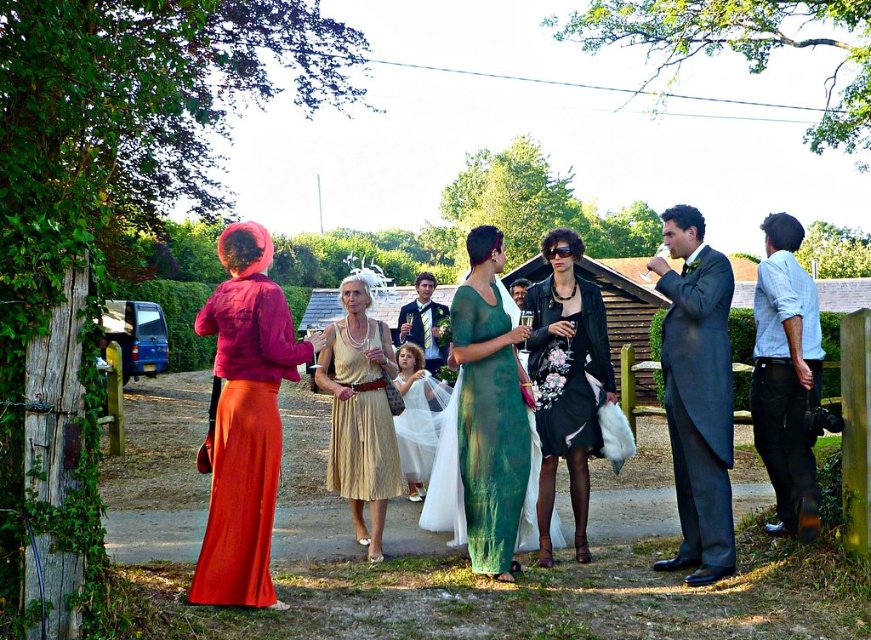
Does matte pink jacket at center have a greater width compared to black leather dress at center?

Indeed, matte pink jacket at center has a greater width compared to black leather dress at center.

Can you confirm if matte pink jacket at center is smaller than black leather dress at center?

No.

Measure the distance between point (227, 572) and camera.

4.59 meters

The width and height of the screenshot is (871, 640). Find the location of `matte pink jacket at center`. matte pink jacket at center is located at coordinates (245, 419).

Is black leather dress at center further to the viewer compared to light blue denim shirt at right?

Yes, black leather dress at center is behind light blue denim shirt at right.

Between black leather dress at center and light blue denim shirt at right, which one has less height?

light blue denim shirt at right

Who is more forward, (538,426) or (800,536)?

Positioned in front is point (800,536).

In order to click on black leather dress at center in this screenshot , I will do `click(566, 381)`.

Can you confirm if matte pink jacket at center is wider than dark gray suit at right?

Yes.

Does matte pink jacket at center appear on the left side of dark gray suit at right?

Yes, matte pink jacket at center is to the left of dark gray suit at right.

Between point (238, 243) and point (680, 442), which one is positioned in front?

Point (238, 243)

I want to click on matte pink jacket at center, so click(245, 419).